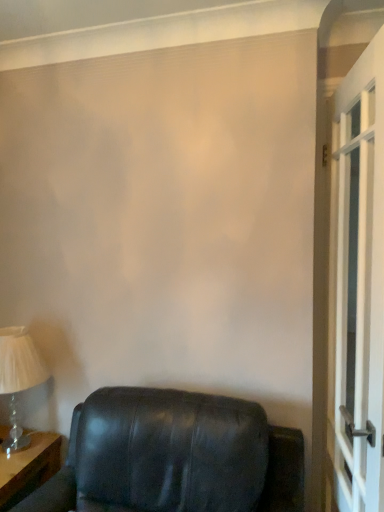
Question: Is wooden table at lower left to the left of matte black leather chair at lower left from the viewer's perspective?

Choices:
 (A) yes
 (B) no

Answer: (A)

Question: Is wooden table at lower left not within matte black leather chair at lower left?

Choices:
 (A) no
 (B) yes

Answer: (B)

Question: Is wooden table at lower left facing away from matte black leather chair at lower left?

Choices:
 (A) no
 (B) yes

Answer: (A)

Question: From a real-world perspective, is wooden table at lower left positioned under matte black leather chair at lower left based on gravity?

Choices:
 (A) no
 (B) yes

Answer: (B)

Question: Is wooden table at lower left positioned far away from matte black leather chair at lower left?

Choices:
 (A) yes
 (B) no

Answer: (B)

Question: Can you confirm if wooden table at lower left is bigger than matte black leather chair at lower left?

Choices:
 (A) no
 (B) yes

Answer: (A)

Question: Is matte white lampshade at left positioned far away from white glass screen door at right?

Choices:
 (A) no
 (B) yes

Answer: (B)

Question: Can white glass screen door at right be found inside matte white lampshade at left?

Choices:
 (A) yes
 (B) no

Answer: (B)

Question: Is matte white lampshade at left oriented away from white glass screen door at right?

Choices:
 (A) no
 (B) yes

Answer: (A)

Question: From the image's perspective, is matte white lampshade at left over white glass screen door at right?

Choices:
 (A) no
 (B) yes

Answer: (A)

Question: From a real-world perspective, does matte white lampshade at left stand above white glass screen door at right?

Choices:
 (A) no
 (B) yes

Answer: (A)

Question: Is matte white lampshade at left thinner than white glass screen door at right?

Choices:
 (A) yes
 (B) no

Answer: (B)

Question: From the image's perspective, is white glass screen door at right under matte white lampshade at left?

Choices:
 (A) yes
 (B) no

Answer: (B)